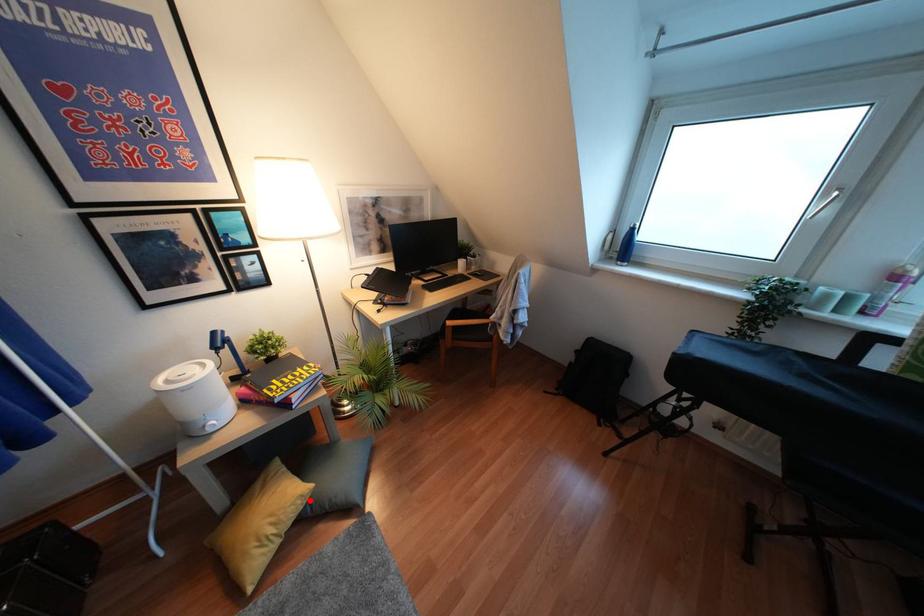
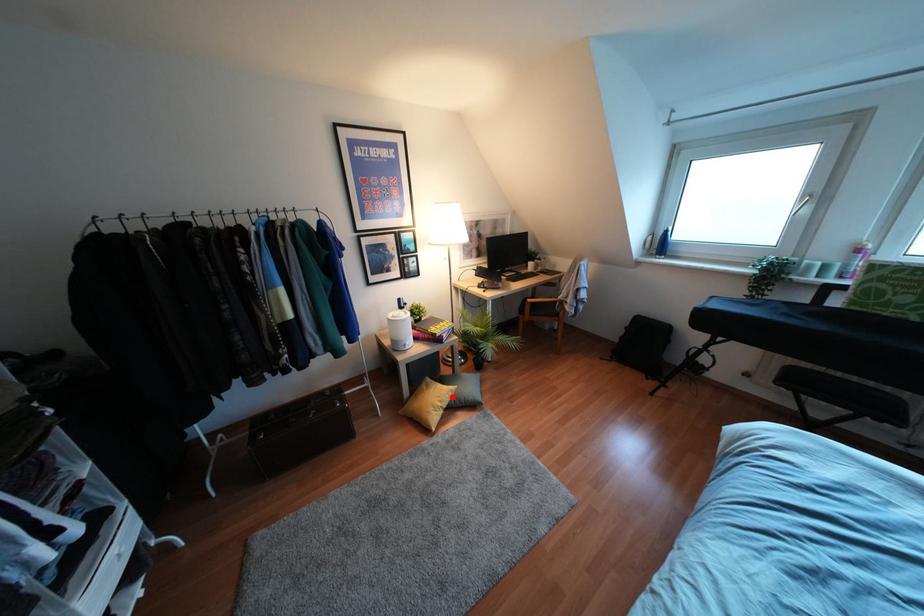
I am providing you with two images of the same scene from different viewpoints. A red point is marked on the first image and another point is marked on the second image. Is the red point in image1 aligned with the point shown in image2?

Yes